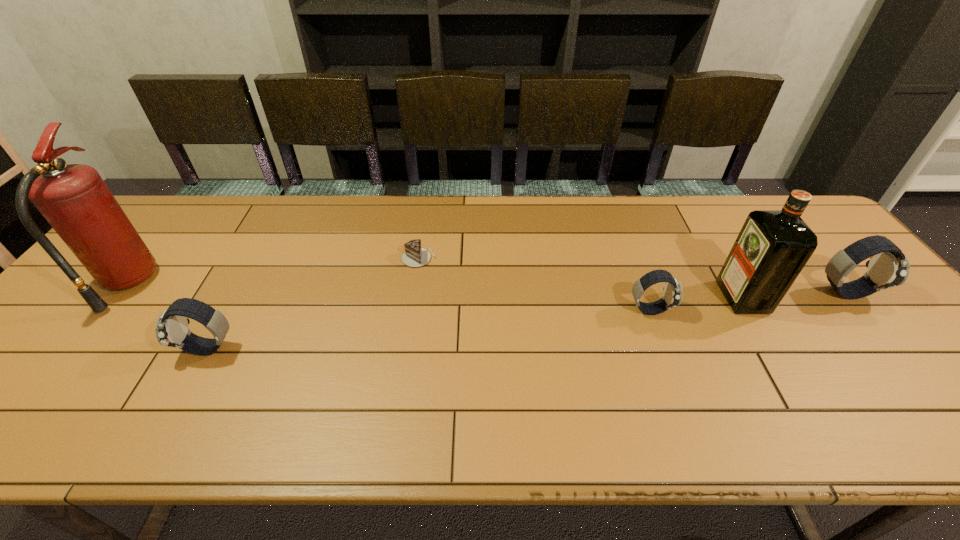
To achieve uniform spacing by inserting another watch among them, please point to a free space for this new watch. Please provide its 2D coordinates. Your answer should be formatted as a tuple, i.e. [(x, y)], where the tuple contains the x and y coordinates of a point satisfying the conditions above.

[(438, 328)]